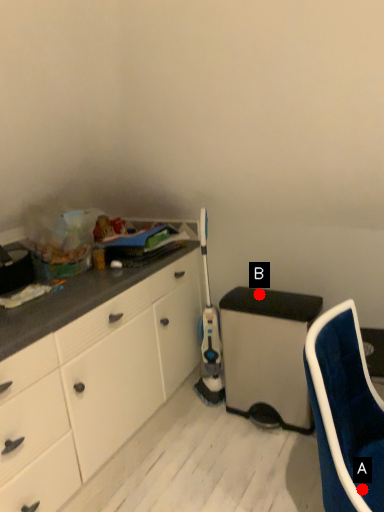
Question: Two points are circled on the image, labeled by A and B beside each circle. Which point appears farthest from the camera in this image?

Choices:
 (A) A is further
 (B) B is further

Answer: (B)